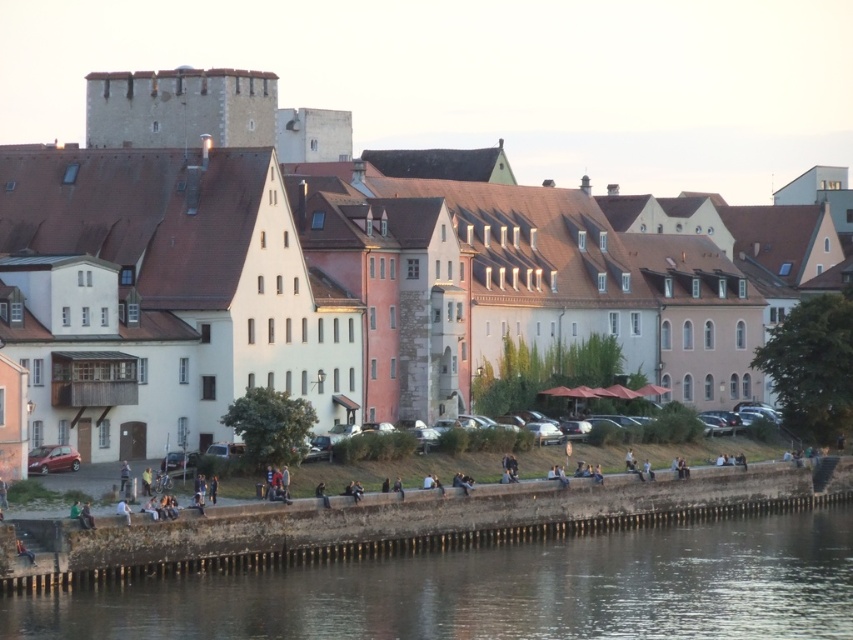
Does white stone buildings at center have a greater width compared to smooth concrete wall at lower center?

Yes.

Is point (506, 305) closer to camera compared to point (573, 552)?

No.

What are the coordinates of `white stone buildings at center` in the screenshot? It's located at 351,269.